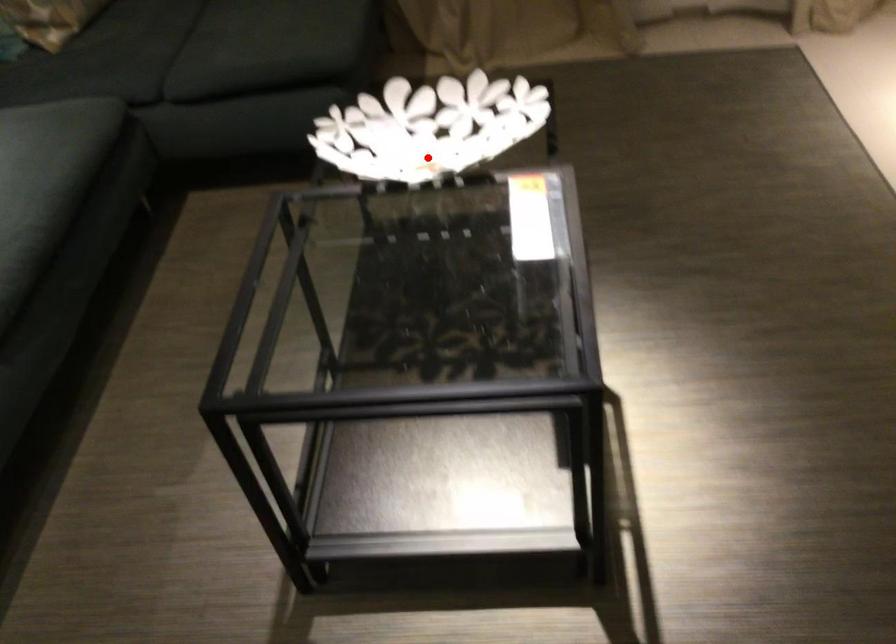
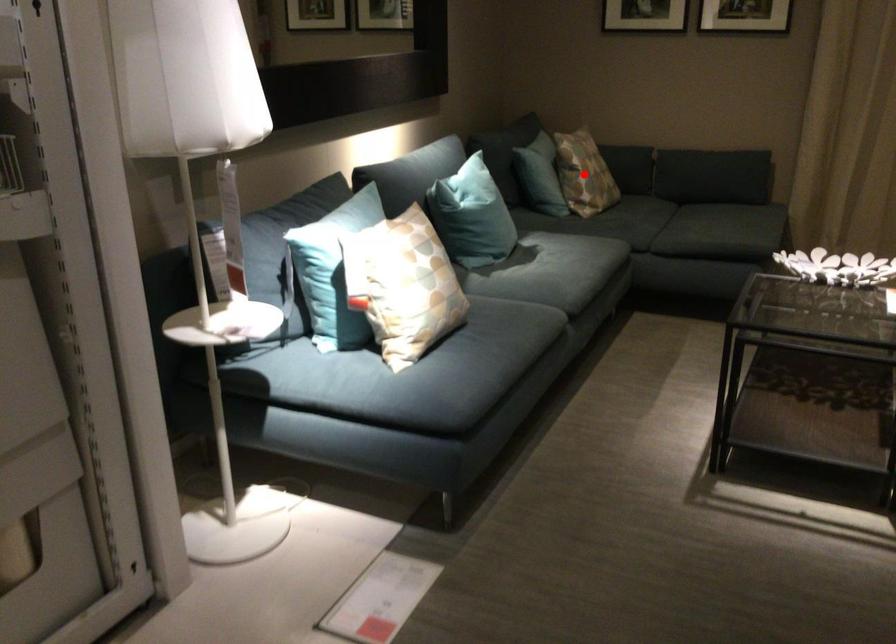
I am providing you with two images of the same scene from different viewpoints. A red point is marked on the first image and another point is marked on the second image. Does the point marked in image1 correspond to the same location as the one in image2?

No